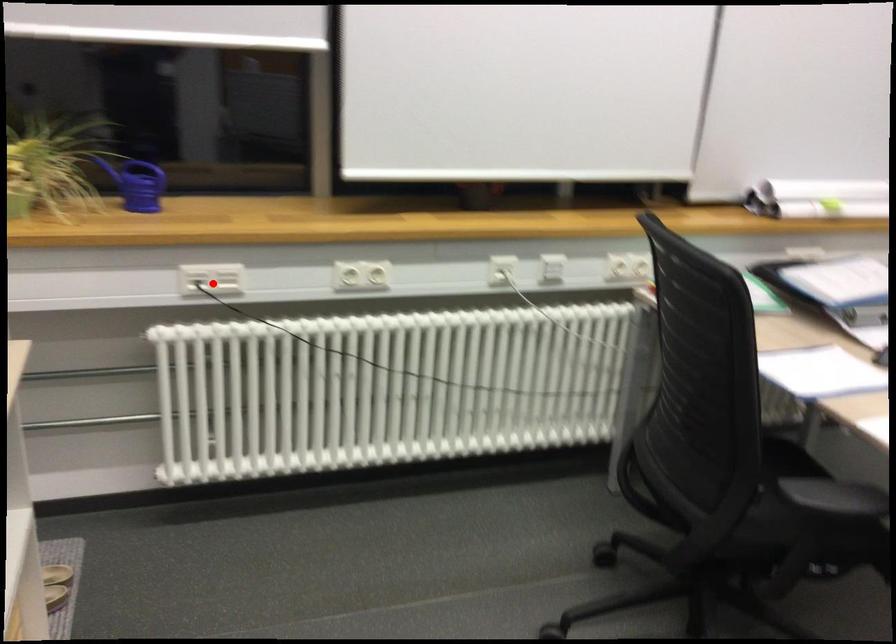
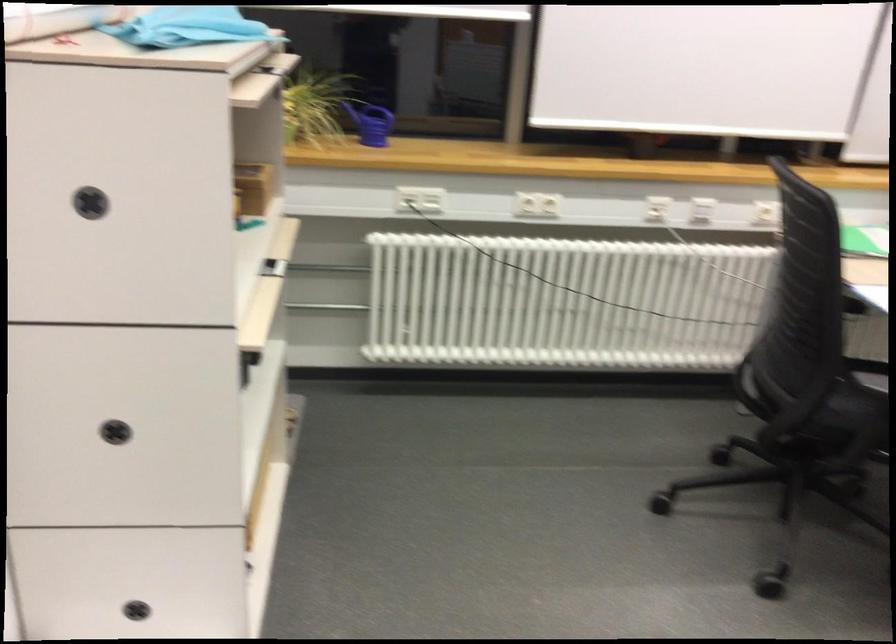
Question: I am providing you with two images of the same scene from different viewpoints. A red point is shown in image1. For the corresponding object point in image2, is it positioned nearer or farther from the camera?

Choices:
 (A) Nearer
 (B) Farther

Answer: (B)